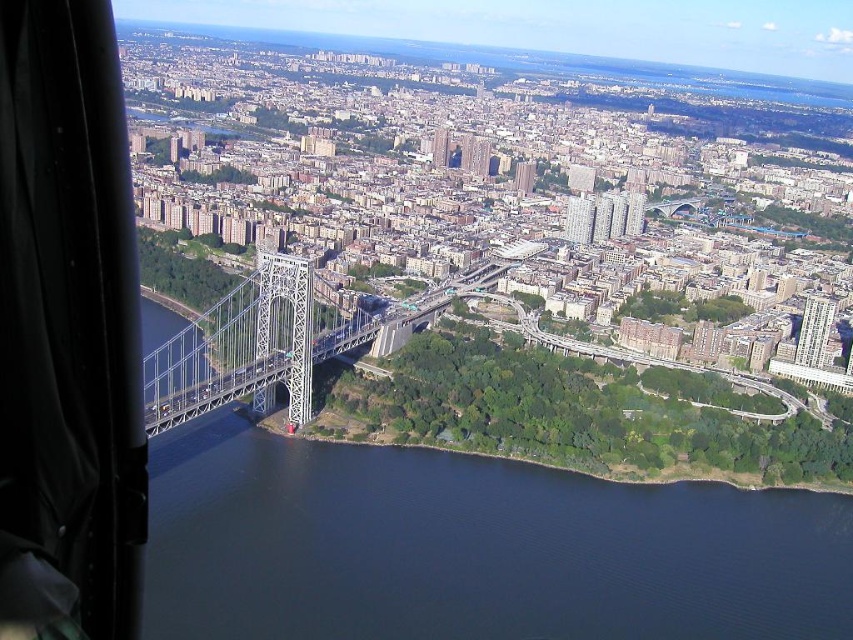
You are standing at the edge of the suspension bridge and want to know how far the dark blue water at lower center is from your current position. Can you determine the distance?

The dark blue water at lower center is 191.73 meters away from the viewer.

You are a drone operator who needs to deliver a package to a landing pad located at coordinates 0.856, 0.555. Your drone has a limited battery and must avoid the dark blue water at lower center. Can you safely land your drone at the target coordinates without touching the water?

The dark blue water at lower center is located exactly at the target coordinates (473,547). Therefore, the drone cannot safely land there as it would land on the water.

You are a drone operator planning to fly a drone from the dark blue water at lower center to the white metallic suspension bridge at center. According to the scene, which direction should you fly the drone to reach the bridge?

The dark blue water at lower center is below the white metallic suspension bridge at center, so you should fly the drone upward to reach the bridge.